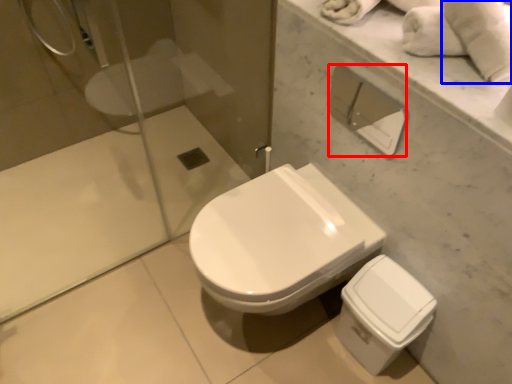
Question: Among these objects, which one is nearest to the camera, toilet paper (highlighted by a red box) or bath towel (highlighted by a blue box)?

Choices:
 (A) toilet paper
 (B) bath towel

Answer: (B)